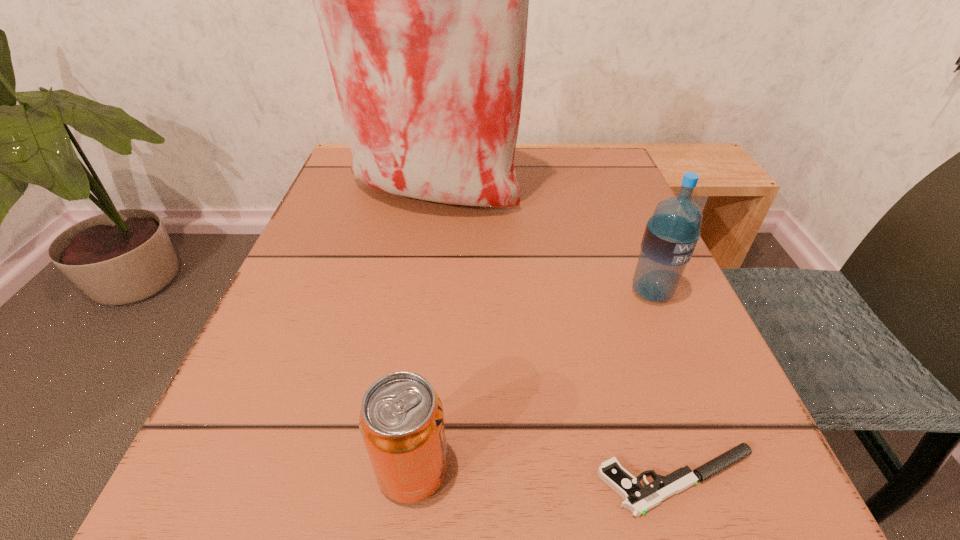
At what (x,y) coordinates should I click in order to perform the action: click on vacant area situated 0.400m on the front-facing side of the shortest object. Please return your answer as a coordinate pair (x, y). The width and height of the screenshot is (960, 540). Looking at the image, I should click on (225, 481).

You are a GUI agent. You are given a task and a screenshot of the screen. Output one action in this format:
    pyautogui.click(x=<x>, y=<y>)
    Task: Click on the vacant space located 0.320m on the front-facing side of the shortest object
    The height and width of the screenshot is (540, 960).
    Given the screenshot: What is the action you would take?
    [300, 481]

You are a GUI agent. You are given a task and a screenshot of the screen. Output one action in this format:
    pyautogui.click(x=<x>, y=<y>)
    Task: Click on the object situated at the far edge
    The image size is (960, 540).
    Given the screenshot: What is the action you would take?
    pyautogui.click(x=422, y=0)

The height and width of the screenshot is (540, 960). I want to click on soda can present at the near edge, so click(401, 421).

Find the location of a particular element. pistol that is at the near edge is located at coordinates (638, 499).

Where is `object present at the left edge`? Image resolution: width=960 pixels, height=540 pixels. object present at the left edge is located at coordinates (422, 0).

Identify the location of water bottle present at the right edge. (671, 234).

The height and width of the screenshot is (540, 960). Find the location of `pistol located at the right edge`. pistol located at the right edge is located at coordinates (638, 499).

Identify the location of object located at the far left corner. (422, 0).

The height and width of the screenshot is (540, 960). Identify the location of object that is at the near right corner. (638, 499).